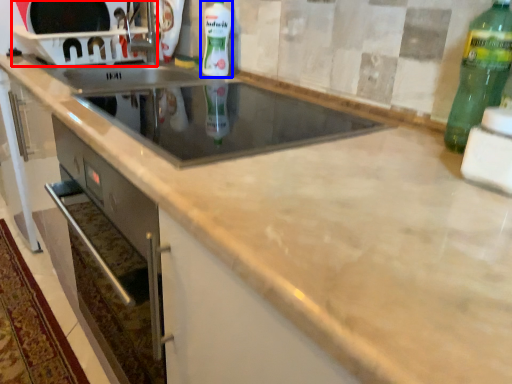
Question: Which of the following is the farthest to the observer, appliance (highlighted by a red box) or bottle (highlighted by a blue box)?

Choices:
 (A) appliance
 (B) bottle

Answer: (A)